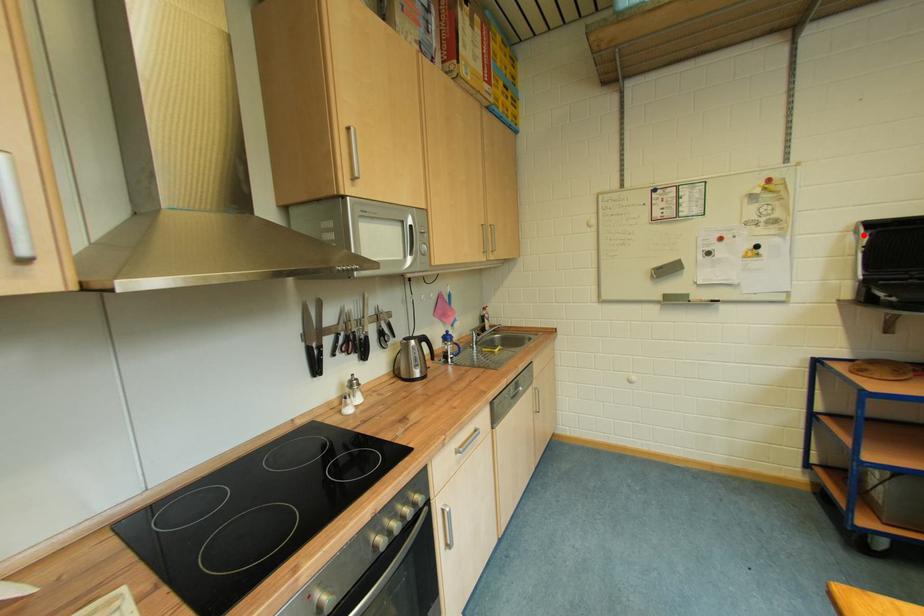
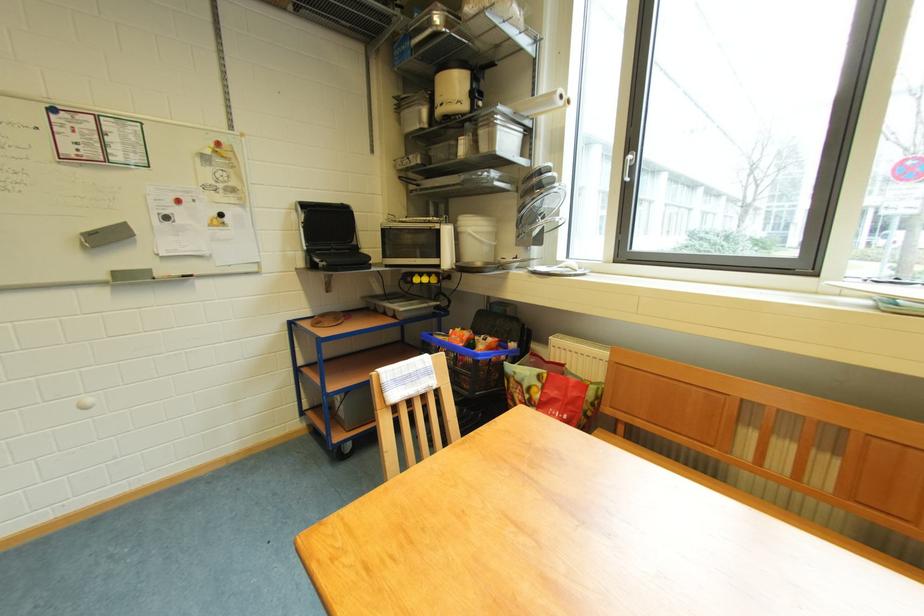
Where in the second image is the point corresponding to the highlighted location from the first image?

(305, 214)